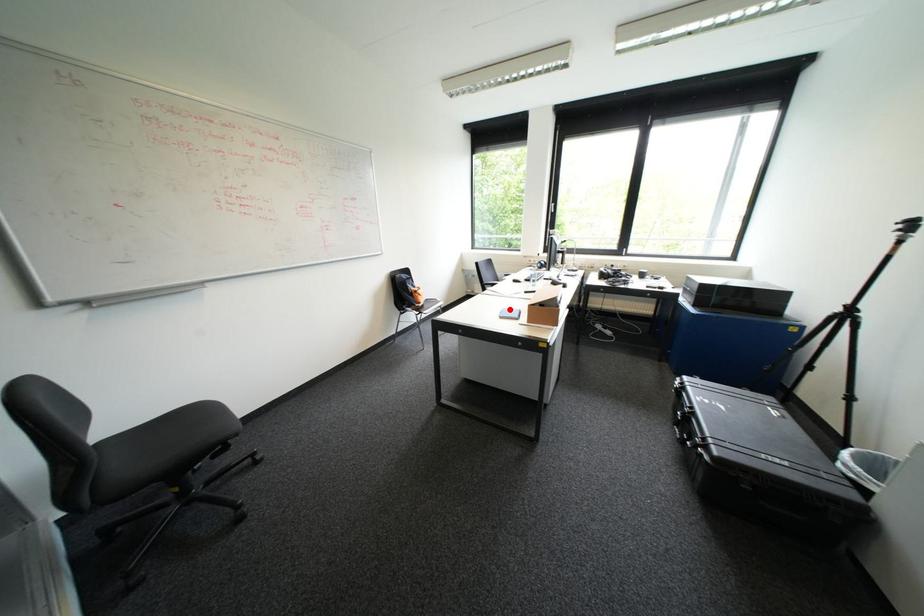
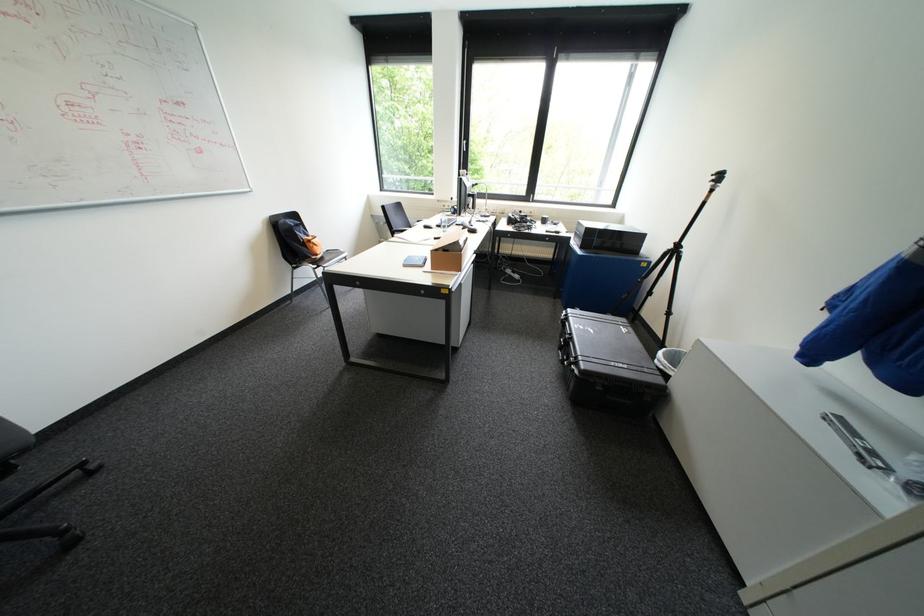
Question: I am providing you with two images of the same scene from different viewpoints. A red point is marked on the first image. At the location where the point appears in image 1, is it still visible in image 2?

Choices:
 (A) Yes
 (B) No

Answer: (A)